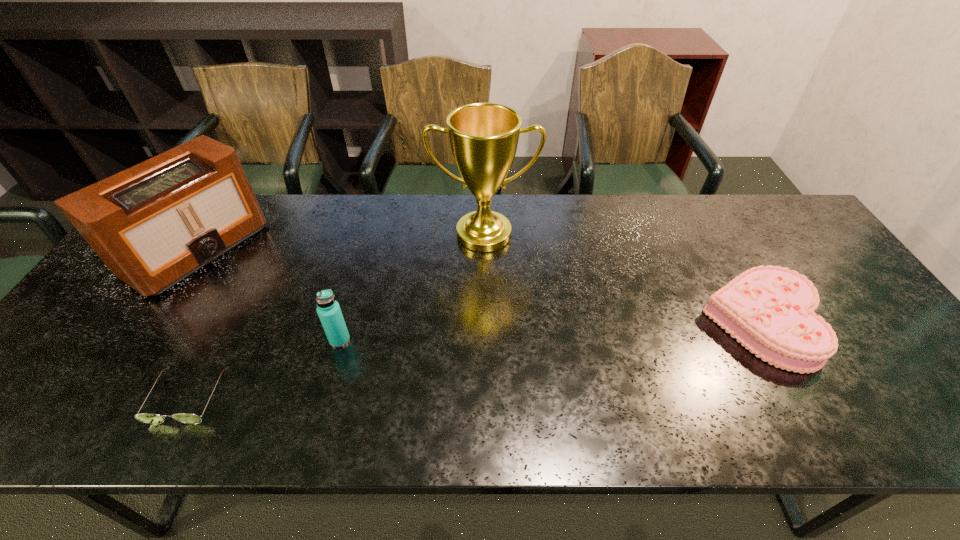
Where is `vacant region located 0.140m on the front of the water bottle`? This screenshot has width=960, height=540. vacant region located 0.140m on the front of the water bottle is located at coordinates (323, 402).

At what (x,y) coordinates should I click in order to perform the action: click on vacant space positioned 0.060m on the back of the second shortest object. Please return your answer as a coordinate pair (x, y). The height and width of the screenshot is (540, 960). Looking at the image, I should click on (730, 266).

The height and width of the screenshot is (540, 960). Find the location of `award present at the far edge`. award present at the far edge is located at coordinates point(484,137).

This screenshot has height=540, width=960. Find the location of `radio receiver located at the far edge`. radio receiver located at the far edge is located at coordinates (154, 224).

Find the location of a particular element. Image resolution: width=960 pixels, height=540 pixels. object present at the near edge is located at coordinates (149, 418).

This screenshot has width=960, height=540. In order to click on object that is at the left edge in this screenshot , I will do click(154, 224).

Locate an element on the screen. object located at the right edge is located at coordinates (769, 309).

Locate an element on the screen. The height and width of the screenshot is (540, 960). object present at the far left corner is located at coordinates pyautogui.click(x=154, y=224).

The height and width of the screenshot is (540, 960). I want to click on vacant region at the far edge, so click(x=526, y=231).

Identify the location of free space at the near edge. (491, 428).